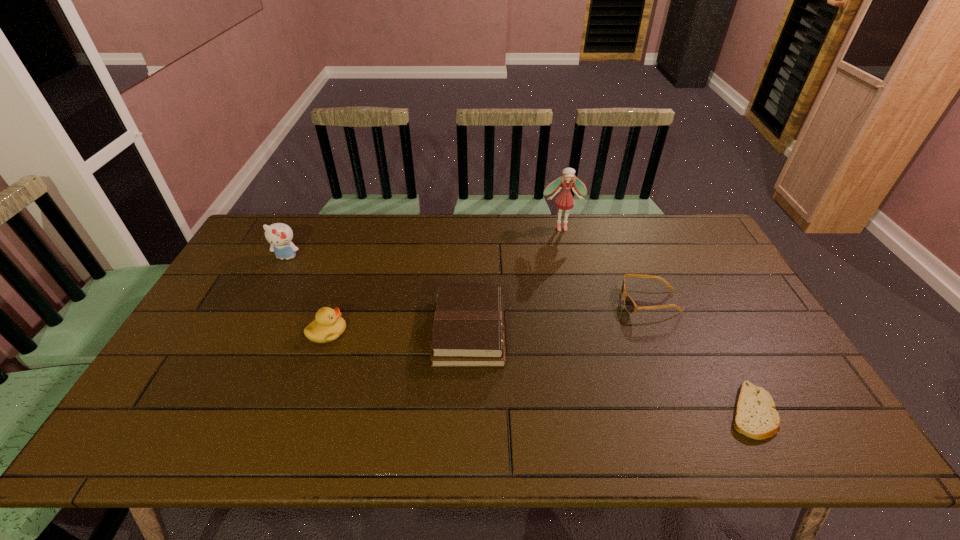
Where is `the tallest object`? This screenshot has height=540, width=960. the tallest object is located at coordinates (565, 201).

Where is `the farthest object`? This screenshot has width=960, height=540. the farthest object is located at coordinates (565, 201).

Find the location of `the leftmost object`. the leftmost object is located at coordinates [x=279, y=235].

Locate an element on the screen. This screenshot has width=960, height=540. the fifth nearest object is located at coordinates (279, 235).

Find the location of `the third tallest object`. the third tallest object is located at coordinates (328, 325).

The width and height of the screenshot is (960, 540). In order to click on duckling in this screenshot , I will do `click(328, 325)`.

At what (x,y) coordinates should I click in order to perform the action: click on the fourth object from right to left. Please return your answer as a coordinate pair (x, y). The height and width of the screenshot is (540, 960). Looking at the image, I should click on (468, 329).

I want to click on the fourth tallest object, so click(468, 329).

I want to click on sunglasses, so click(x=630, y=306).

Locate an element on the screen. The image size is (960, 540). the shortest object is located at coordinates (755, 416).